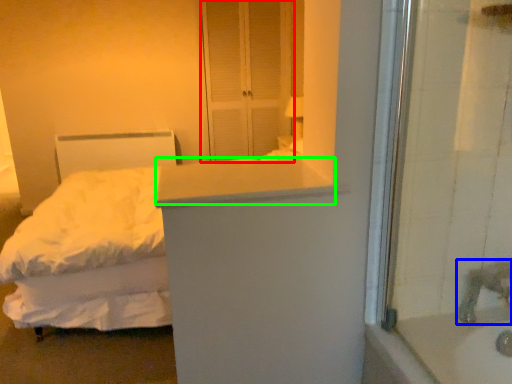
Question: Which object is positioned farthest from screen door (highlighted by a red box)? Select from faucet (highlighted by a blue box) and counter top (highlighted by a green box).

Choices:
 (A) faucet
 (B) counter top

Answer: (A)